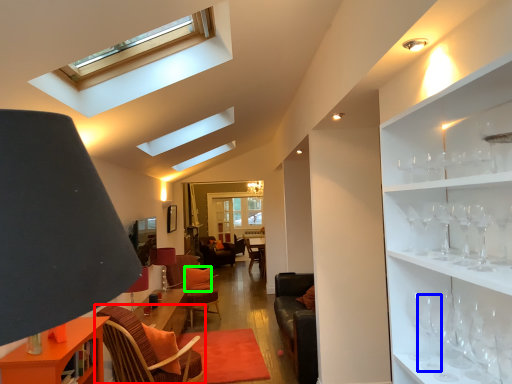
Question: Considering the real-world distances, which object is farthest from chair (highlighted by a red box)? wine glass (highlighted by a blue box) or pillow (highlighted by a green box)?

Choices:
 (A) wine glass
 (B) pillow

Answer: (B)